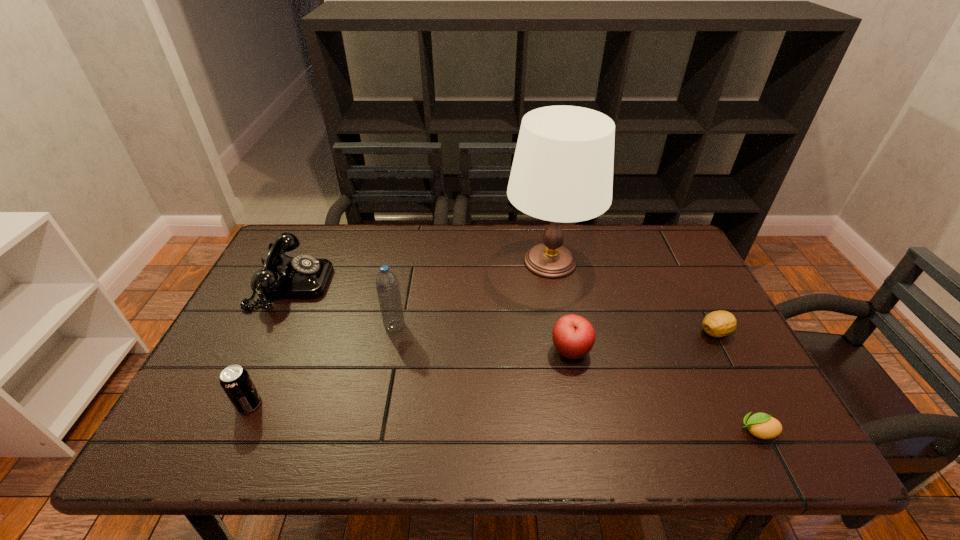
Identify the location of vacant space located with leaves positioned above the nearest object. This screenshot has width=960, height=540. (701, 431).

Where is `lamp that is at the far edge`? The width and height of the screenshot is (960, 540). lamp that is at the far edge is located at coordinates (562, 171).

Where is `telephone that is positioned at the far edge`? telephone that is positioned at the far edge is located at coordinates (282, 277).

At what (x,y) coordinates should I click in order to perform the action: click on object present at the near edge. Please return your answer as a coordinate pair (x, y). This screenshot has width=960, height=540. Looking at the image, I should click on (761, 425).

This screenshot has height=540, width=960. I want to click on telephone at the left edge, so click(x=282, y=277).

The image size is (960, 540). In order to click on soda can that is at the left edge in this screenshot , I will do `click(236, 382)`.

Identify the location of object at the far left corner. (282, 277).

The image size is (960, 540). Identify the location of object that is at the near right corner. (761, 425).

In the image, there is a desktop. Identify the location of free space at the far edge. The image size is (960, 540). (408, 259).

Locate an element on the screen. This screenshot has height=540, width=960. vacant space at the near edge of the desktop is located at coordinates (548, 451).